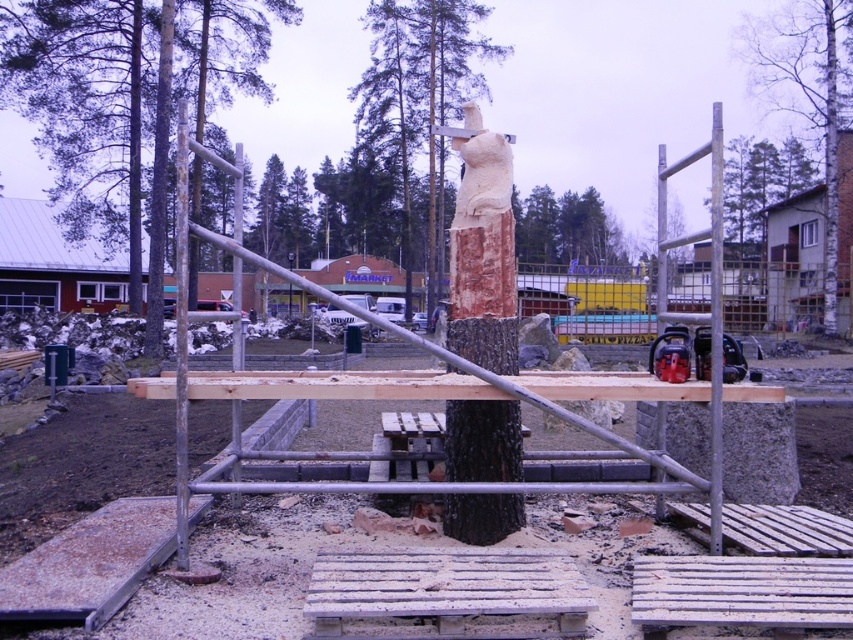
Question: Based on their relative distances, which object is farther from the bark at center?

Choices:
 (A) smooth brown tree trunk at center
 (B) smooth wood carving at center
 (C) brown wood tree at center
 (D) smooth silver pole at right

Answer: (C)

Question: Which object is positioned closest to the smooth brown tree trunk at center?

Choices:
 (A) smooth silver pole at right
 (B) brown wood tree at center
 (C) bark at center

Answer: (C)

Question: Estimate the real-world distances between objects in this image. Which object is closer to the bark at center?

Choices:
 (A) smooth wood carving at center
 (B) brown wood tree at center

Answer: (A)

Question: In this image, where is smooth wood carving at center located relative to bark at center?

Choices:
 (A) below
 (B) above

Answer: (B)

Question: Observing the image, what is the correct spatial positioning of bark at center in reference to smooth silver pole at right?

Choices:
 (A) left
 (B) right

Answer: (B)

Question: Is bark at center further to the viewer compared to smooth brown tree trunk at center?

Choices:
 (A) no
 (B) yes

Answer: (A)